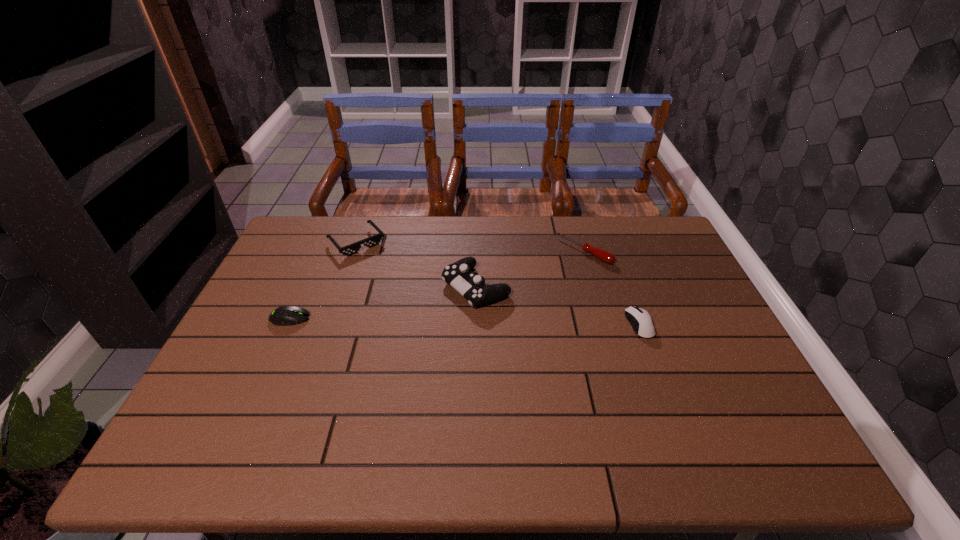
Identify the location of vacant area located at the tip of the screwdriver. (536, 289).

At what (x,y) coordinates should I click in order to perform the action: click on vacant space located 0.140m on the surface of the third object from left to right. Please return your answer as a coordinate pair (x, y). Image resolution: width=960 pixels, height=540 pixels. Looking at the image, I should click on (406, 324).

Identify the location of vacant space located 0.170m on the surface of the third object from left to right. The width and height of the screenshot is (960, 540). (396, 329).

I want to click on vacant space situated 0.170m on the surface of the third object from left to right, so click(x=396, y=329).

Find the location of a particular element. free location located on the front-facing side of the sunglasses is located at coordinates (434, 328).

The image size is (960, 540). Find the location of `vacant space situated 0.400m on the front-facing side of the sunglasses`. vacant space situated 0.400m on the front-facing side of the sunglasses is located at coordinates (434, 328).

At what (x,y) coordinates should I click in order to perform the action: click on free space located 0.220m on the front-facing side of the sunglasses. Please return your answer as a coordinate pair (x, y). The width and height of the screenshot is (960, 540). Looking at the image, I should click on (x=402, y=292).

At what (x,y) coordinates should I click in order to perform the action: click on screwdriver at the far edge. Please return your answer as a coordinate pair (x, y). Looking at the image, I should click on (603, 255).

At what (x,y) coordinates should I click in order to perform the action: click on sunglasses situated at the far edge. Please return your answer as a coordinate pair (x, y). This screenshot has height=540, width=960. Looking at the image, I should click on (374, 240).

Locate an element on the screen. computer mouse that is at the left edge is located at coordinates (287, 315).